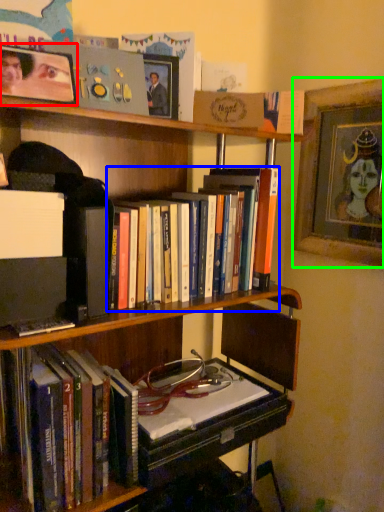
Question: Which object is positioned farthest from picture frame (highlighted by a red box)? Select from book (highlighted by a blue box) and picture frame (highlighted by a green box).

Choices:
 (A) book
 (B) picture frame

Answer: (B)